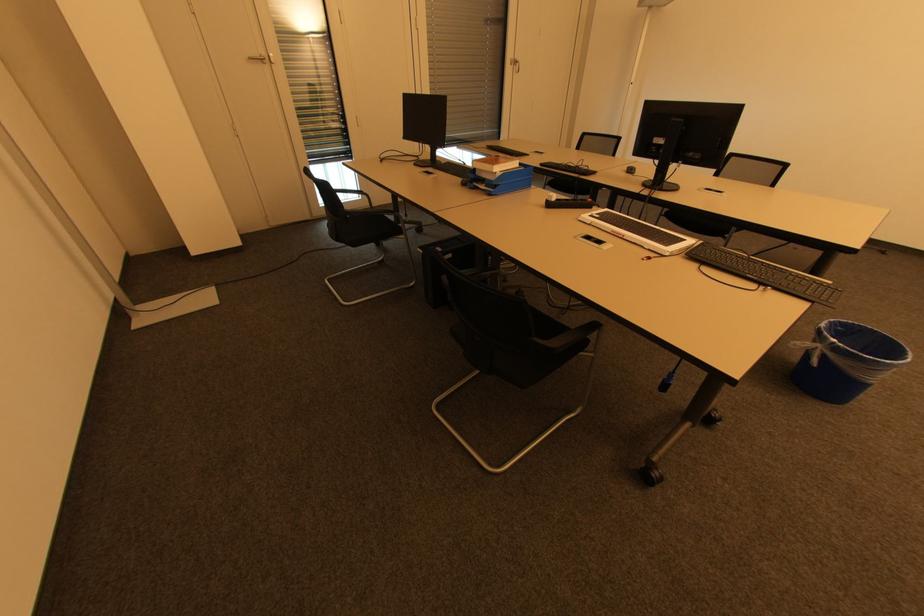
The width and height of the screenshot is (924, 616). What do you see at coordinates (584, 330) in the screenshot?
I see `the black chair armrest` at bounding box center [584, 330].